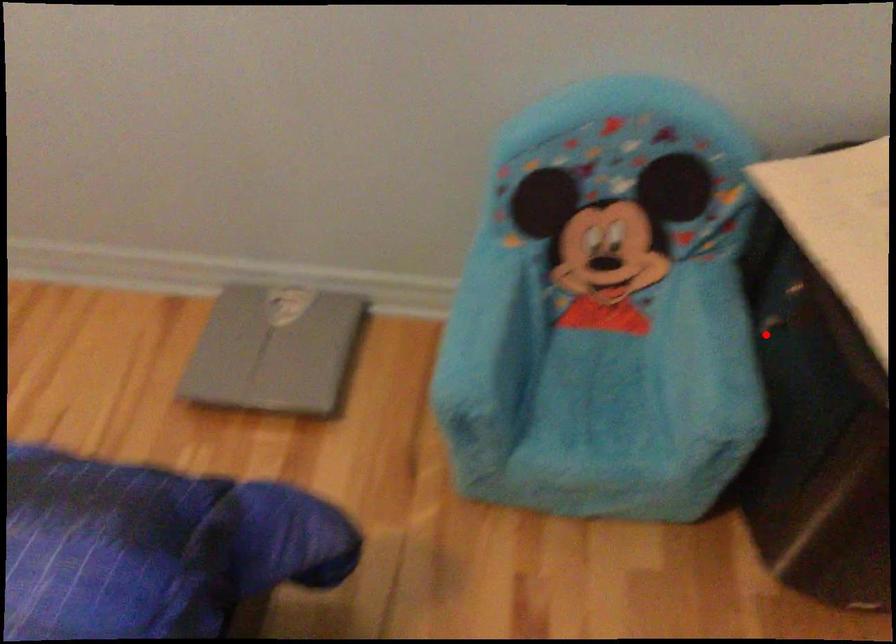
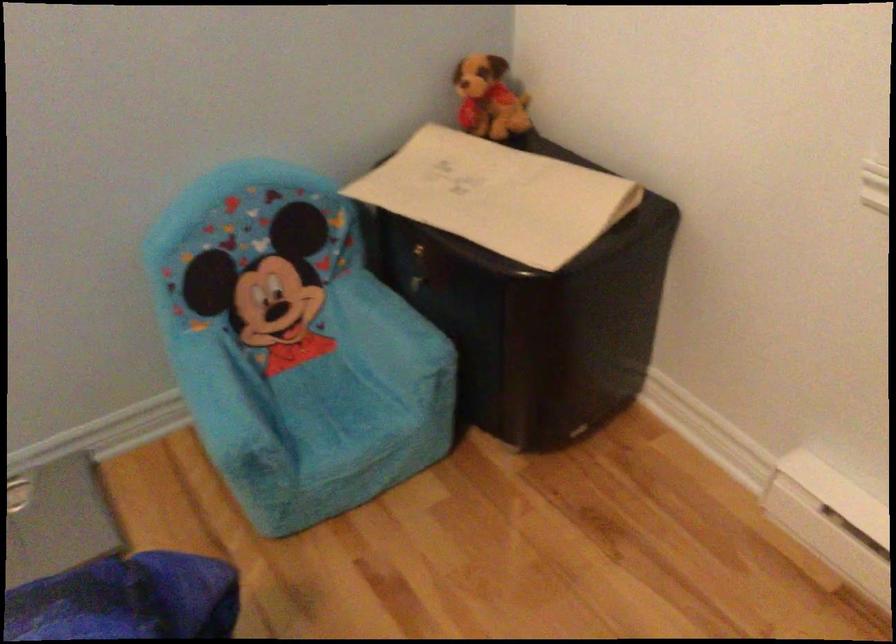
Question: I am providing you with two images of the same scene from different viewpoints. Image1 has a red point marked. In image2, the corresponding 3D location appears at what relative position? Reply with the corresponding letter.

Choices:
 (A) Closer
 (B) Farther

Answer: (B)